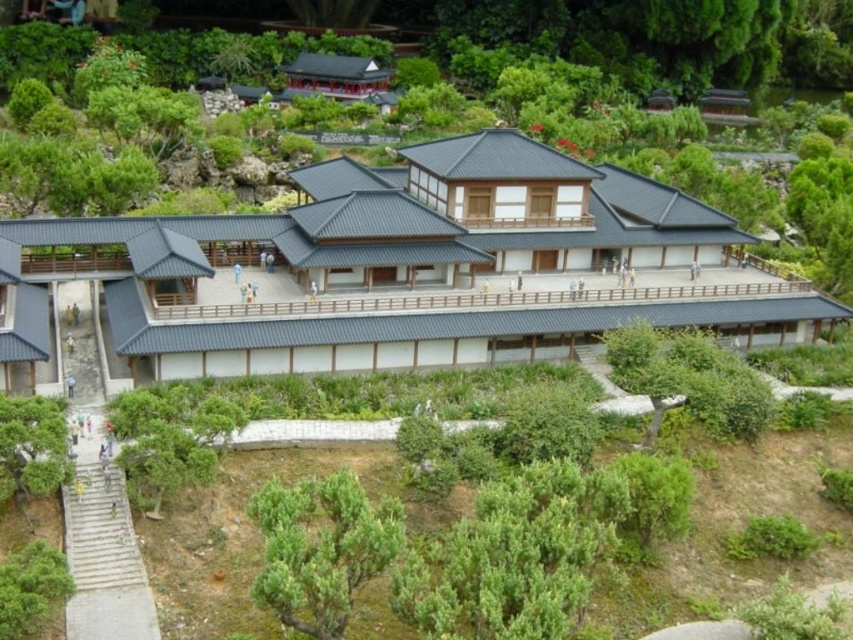
Locate an element on the screen. The image size is (853, 640). green leafy shrub at lower center is located at coordinates 321,548.

Does point (334, 580) lie in front of point (9, 422)?

Yes, it is in front of point (9, 422).

What do you see at coordinates (321, 548) in the screenshot? I see `green leafy shrub at lower center` at bounding box center [321, 548].

At what (x,y) coordinates should I click in order to perform the action: click on green leafy shrub at lower center. Please return your answer as a coordinate pair (x, y). The height and width of the screenshot is (640, 853). Looking at the image, I should click on (321, 548).